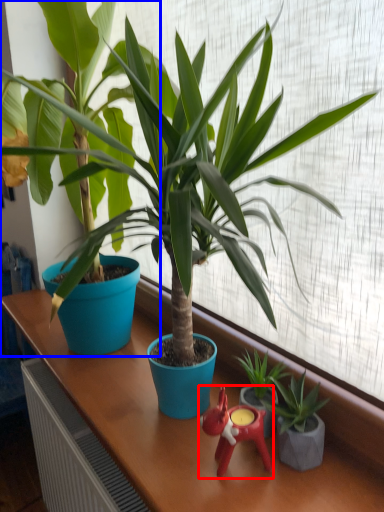
Question: Which object is further to the camera taking this photo, miniature (highlighted by a red box) or houseplant (highlighted by a blue box)?

Choices:
 (A) miniature
 (B) houseplant

Answer: (A)